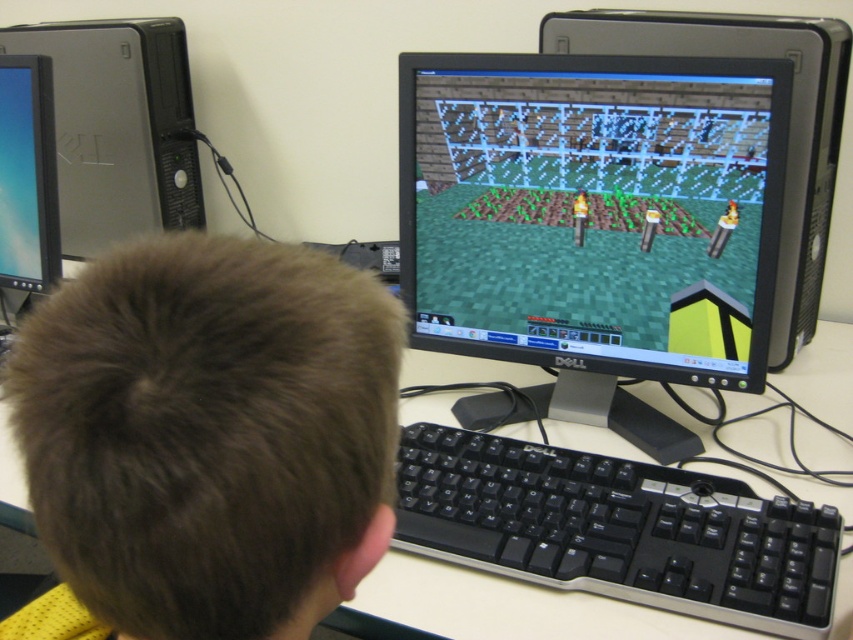
Who is positioned more to the right, matte black monitor at center or black plastic keyboard at center?

matte black monitor at center is more to the right.

Which is more to the left, matte black monitor at center or black plastic keyboard at center?

black plastic keyboard at center

Who is more distant from viewer, (x=772, y=204) or (x=527, y=500)?

Positioned behind is point (x=772, y=204).

Identify the location of matte black monitor at center. The image size is (853, 640). (593, 225).

Is satin silver tower at upper left above matte black monitor at left?

Yes, satin silver tower at upper left is above matte black monitor at left.

Can you confirm if satin silver tower at upper left is thinner than matte black monitor at left?

In fact, satin silver tower at upper left might be wider than matte black monitor at left.

Is point (178, 131) farther from viewer compared to point (59, 240)?

Yes, it is.

I want to click on satin silver tower at upper left, so click(x=119, y=128).

Between brown hair at center and satin silver tower at upper left, which one appears on the left side from the viewer's perspective?

From the viewer's perspective, satin silver tower at upper left appears more on the left side.

Does brown hair at center have a larger size compared to satin silver tower at upper left?

No.

Who is more forward, [55,374] or [144,188]?

Positioned in front is point [55,374].

You are a GUI agent. You are given a task and a screenshot of the screen. Output one action in this format:
    pyautogui.click(x=<x>, y=<y>)
    Task: Click on the brown hair at center
    
    Given the screenshot: What is the action you would take?
    pyautogui.click(x=210, y=435)